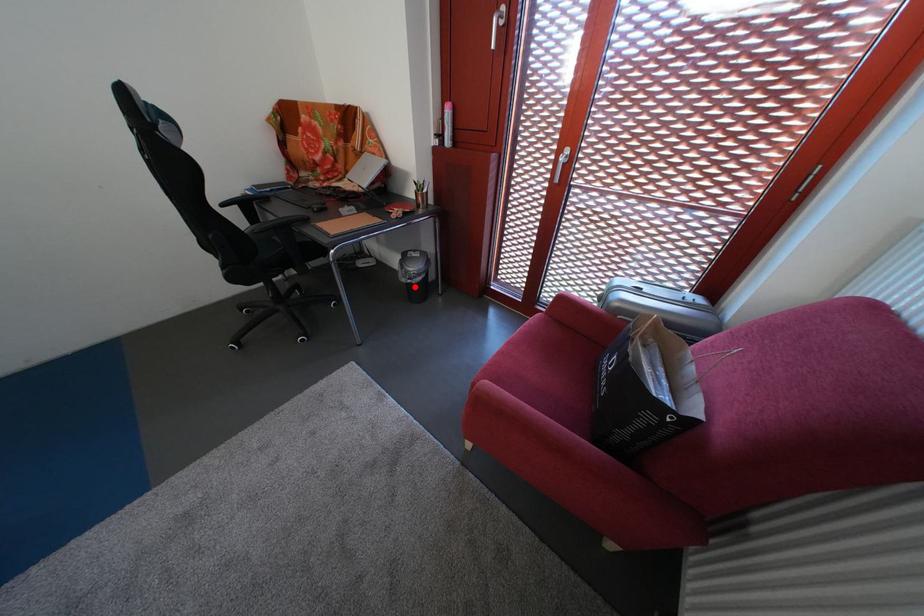
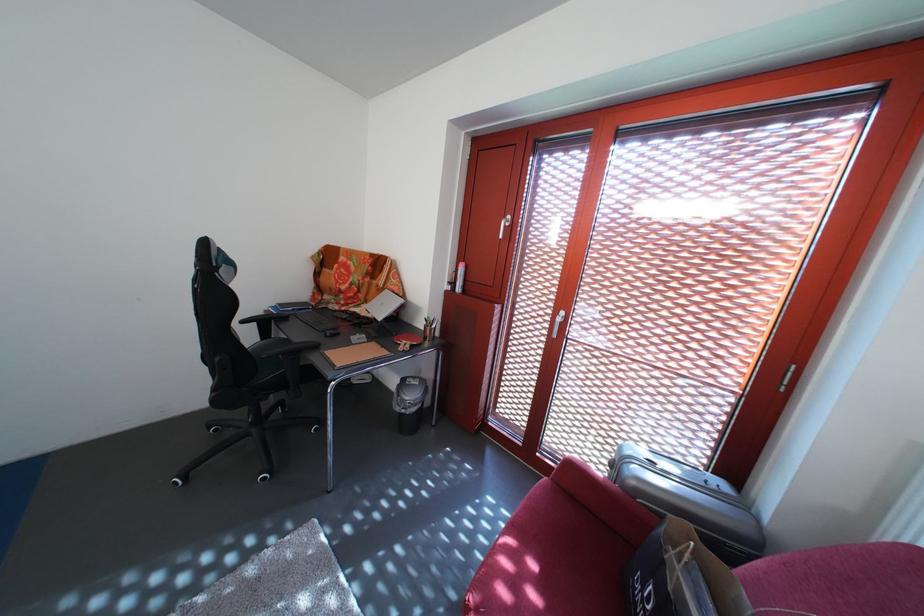
Where in the second image is the point corresponding to the highlighted location from the first image?

(408, 416)